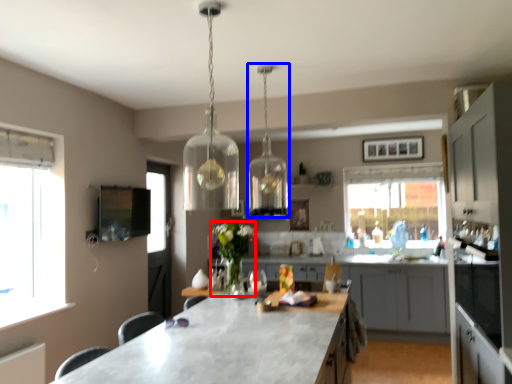
Question: Among these objects, which one is nearest to the camera, flower (highlighted by a red box) or lamp (highlighted by a blue box)?

Choices:
 (A) flower
 (B) lamp

Answer: (B)